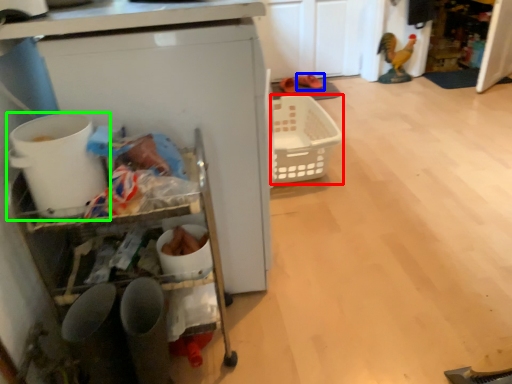
Question: Which is farther away from basket (highlighted by a red box)? footwear (highlighted by a blue box) or appliance (highlighted by a green box)?

Choices:
 (A) footwear
 (B) appliance

Answer: (B)